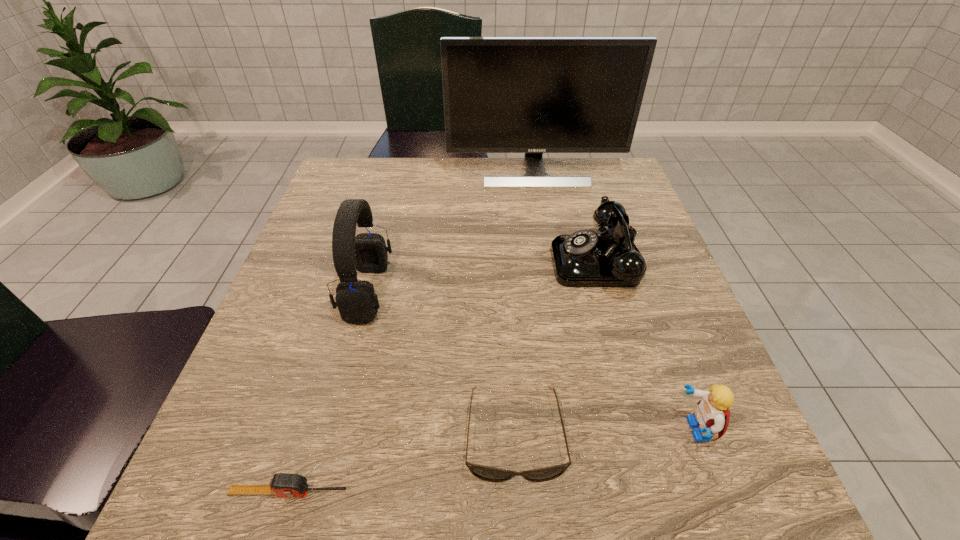
Identify the location of free spot between the telephone and the tape measure. (444, 377).

This screenshot has height=540, width=960. I want to click on empty location between the tape measure and the monitor, so click(412, 332).

Image resolution: width=960 pixels, height=540 pixels. What are the coordinates of `object that is the third closest one to the Lego` in the screenshot? It's located at (282, 484).

Identify which object is the closest to the telephone. Please provide its 2D coordinates. Your answer should be formatted as a tuple, i.e. [(x, y)], where the tuple contains the x and y coordinates of a point satisfying the conditions above.

[(533, 95)]